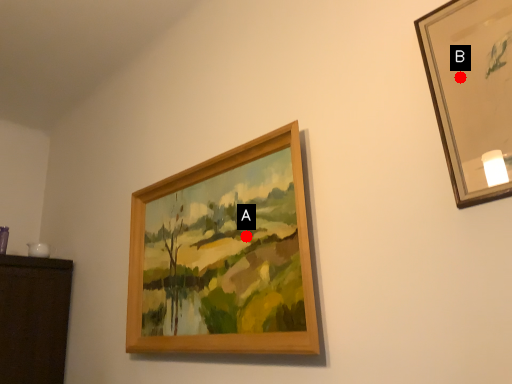
Question: Two points are circled on the image, labeled by A and B beside each circle. Which point is farther from the camera taking this photo?

Choices:
 (A) A is further
 (B) B is further

Answer: (A)